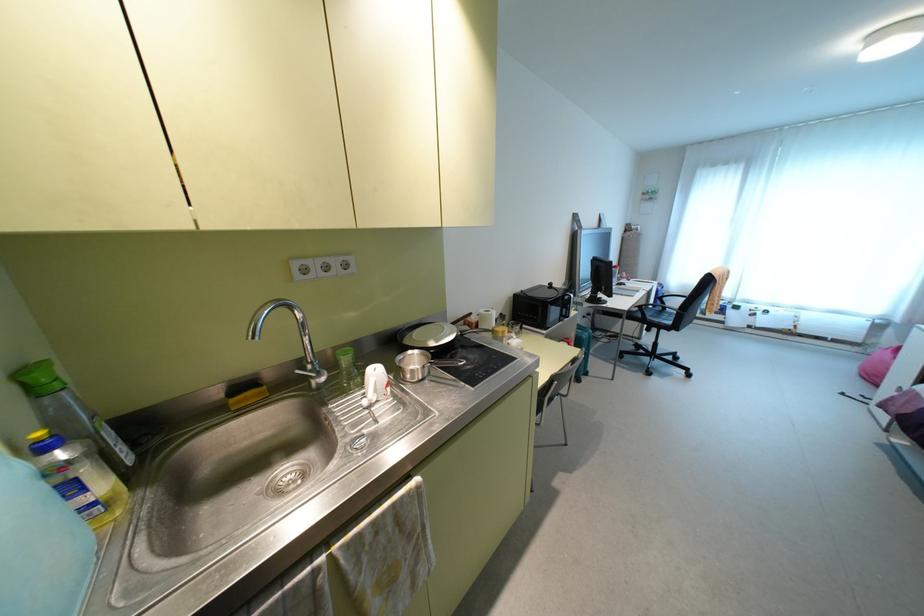
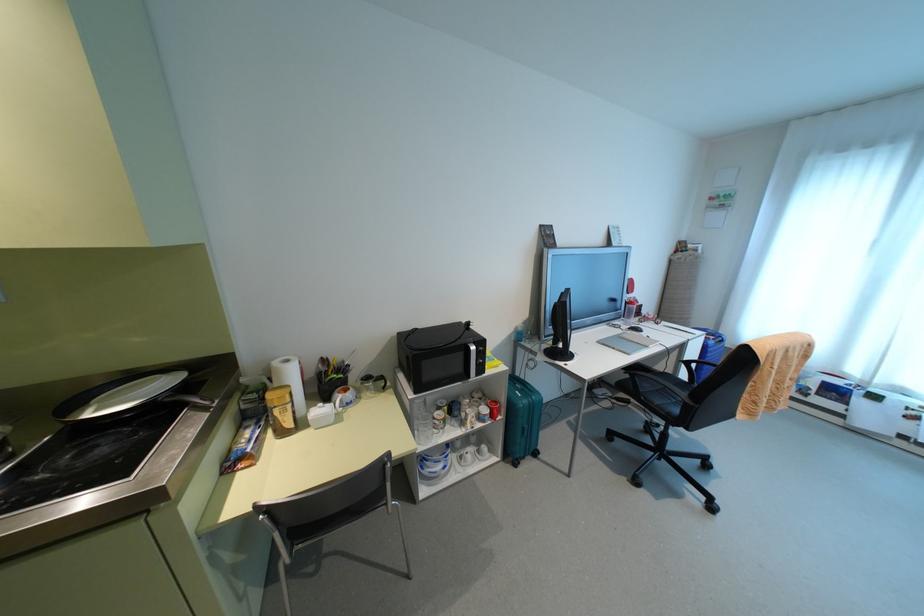
The point at [585,373] is marked in the first image. Where is the corresponding point in the second image?

(535, 454)